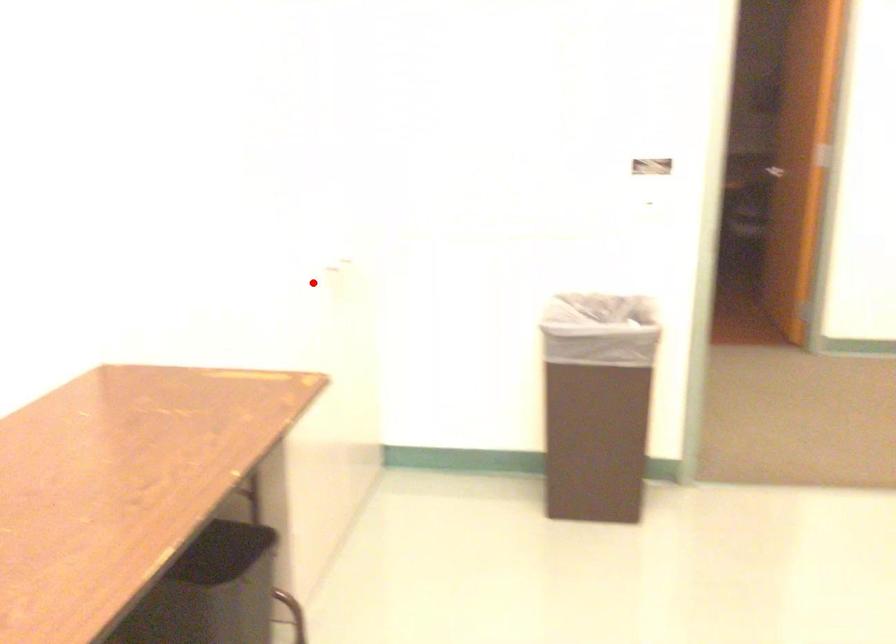
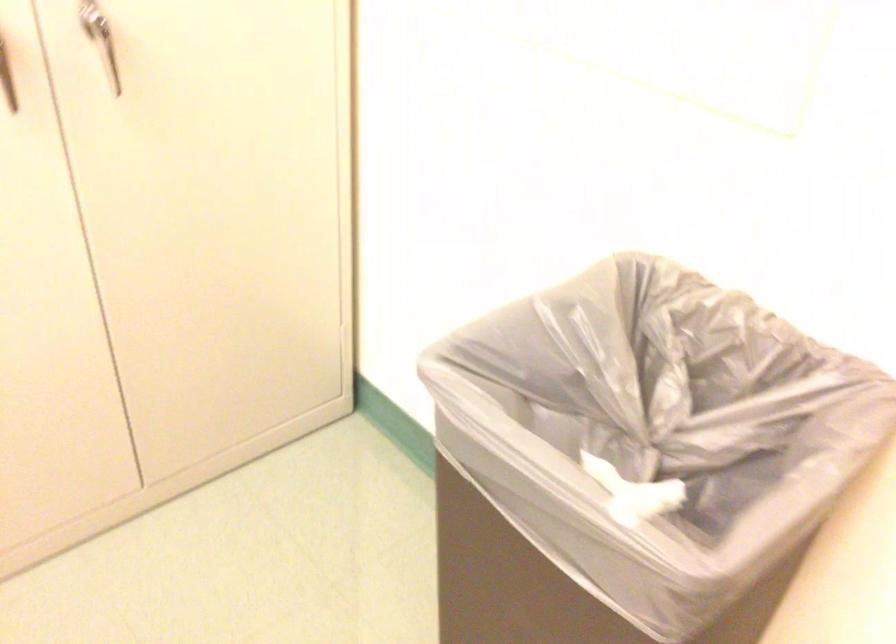
The point at the highlighted location is marked in the first image. Where is the corresponding point in the second image?

(6, 79)